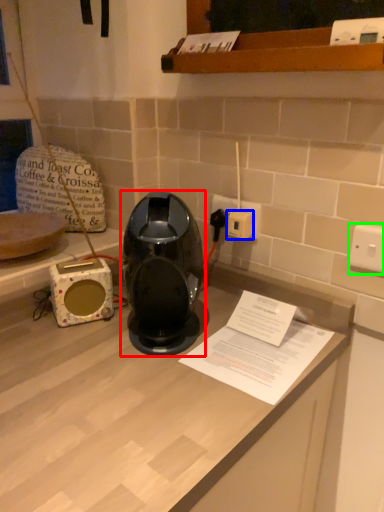
Question: Considering the real-world distances, which object is farthest from home appliance (highlighted by a red box)? socket (highlighted by a blue box) or electric outlet (highlighted by a green box)?

Choices:
 (A) socket
 (B) electric outlet

Answer: (B)